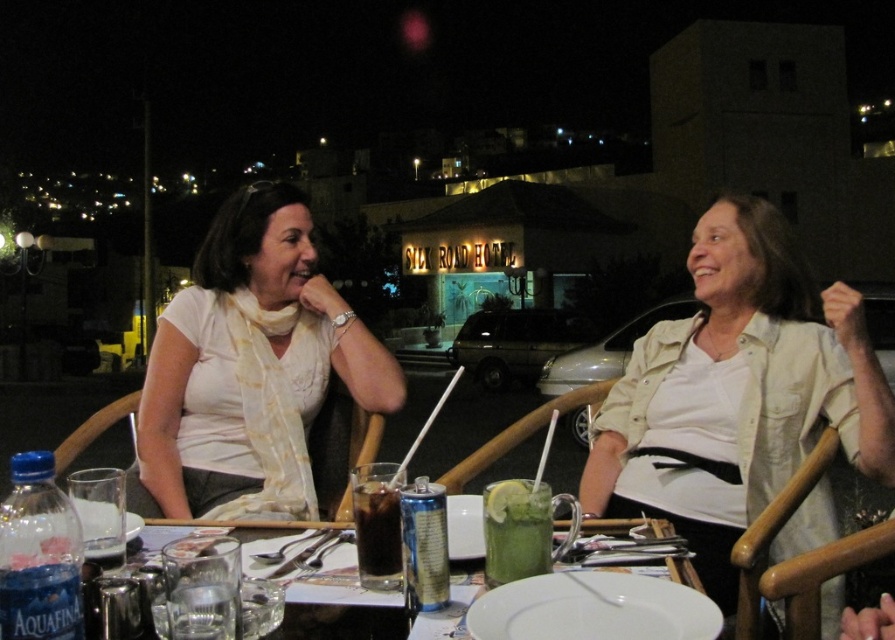
Question: Among these points, which one is nearest to the camera?

Choices:
 (A) (286, 592)
 (B) (369, 516)
 (C) (299, 470)
 (D) (483, 538)

Answer: (A)

Question: Does white matte scarf at upper left have a greater width compared to dark brown glass at center?

Choices:
 (A) no
 (B) yes

Answer: (B)

Question: Estimate the real-world distances between objects in this image. Which object is farther from the white matte scarf at upper left?

Choices:
 (A) green glass drink at center
 (B) dark brown glass at center

Answer: (A)

Question: Which point is farther to the camera?

Choices:
 (A) dark brown glass at center
 (B) clear glass table at center
 (C) white matte scarf at upper left
 (D) green glass drink at center

Answer: (C)

Question: Does clear glass table at center appear on the left side of green glass drink at center?

Choices:
 (A) yes
 (B) no

Answer: (A)

Question: Does white matte scarf at upper left lie in front of green glass drink at center?

Choices:
 (A) no
 (B) yes

Answer: (A)